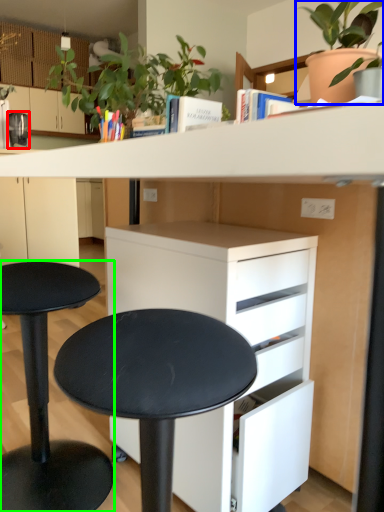
Question: Which object is positioned farthest from appliance (highlighted by a red box)? Select from houseplant (highlighted by a blue box) and stool (highlighted by a green box).

Choices:
 (A) houseplant
 (B) stool

Answer: (A)